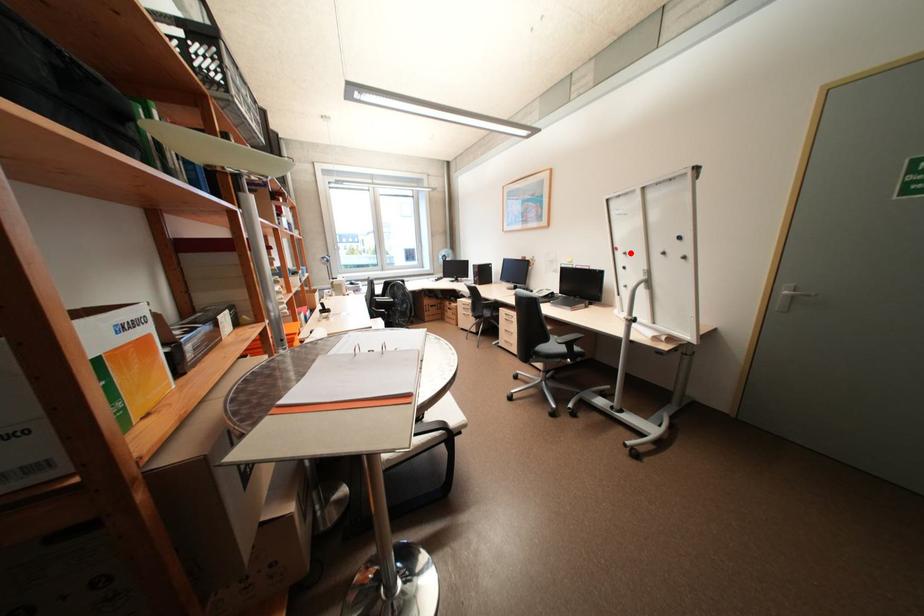
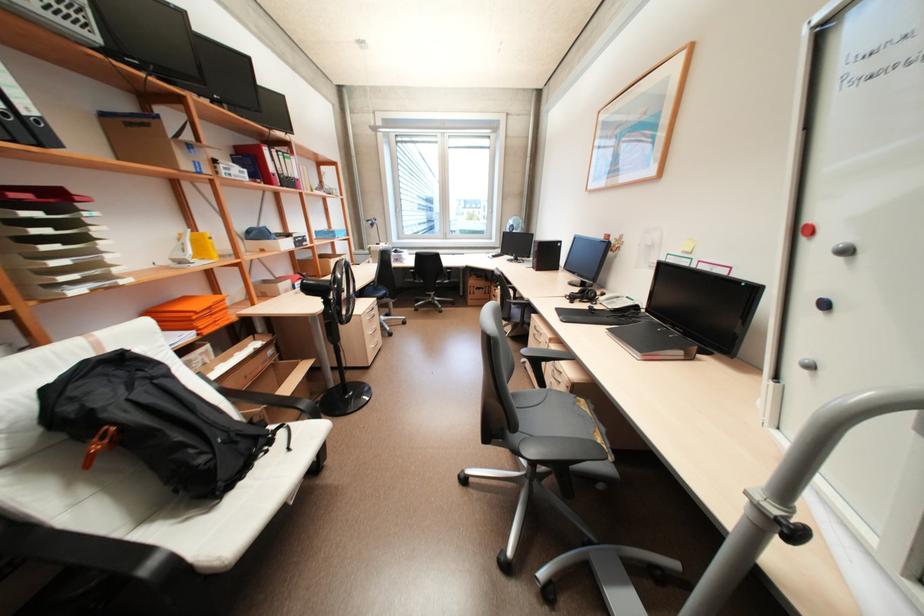
Question: A red point is marked in image1. In image2, is the corresponding 3D point closer to the camera or farther? Reply with the corresponding letter.

Choices:
 (A) The corresponding 3D point is closer.
 (B) The corresponding 3D point is farther.

Answer: (B)